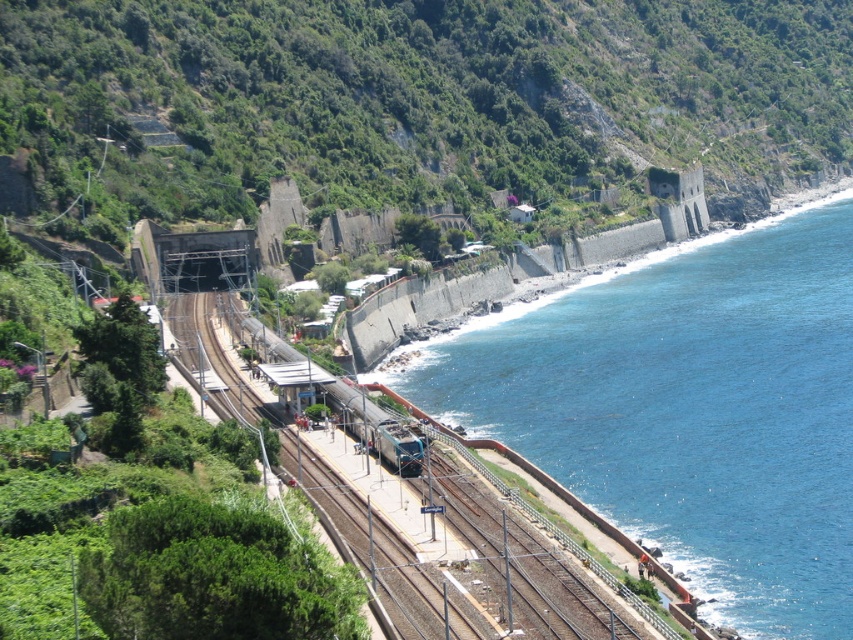
Which is more to the right, blue water at lower right or brown gravel track at center?

blue water at lower right is more to the right.

This screenshot has width=853, height=640. What do you see at coordinates (689, 410) in the screenshot?
I see `blue water at lower right` at bounding box center [689, 410].

The width and height of the screenshot is (853, 640). What do you see at coordinates (689, 410) in the screenshot? I see `blue water at lower right` at bounding box center [689, 410].

Where is `blue water at lower right`? blue water at lower right is located at coordinates (689, 410).

Describe the element at coordinates (689, 410) in the screenshot. This screenshot has height=640, width=853. I see `blue water at lower right` at that location.

Which is below, blue water at lower right or metallic blue train at center?

metallic blue train at center

Is point (517, 346) closer to camera compared to point (376, 433)?

No, it is not.

Where is `blue water at lower right`? This screenshot has width=853, height=640. blue water at lower right is located at coordinates (689, 410).

Consider the image. Can you confirm if brown gravel track at center is bigger than metallic blue train at center?

Correct, brown gravel track at center is larger in size than metallic blue train at center.

Is point (469, 566) farther from camera compared to point (360, 433)?

No, (469, 566) is closer to viewer.

Which is in front, point (190, 324) or point (404, 440)?

Point (404, 440) is in front.

Find the location of a particular element. This screenshot has height=640, width=853. brown gravel track at center is located at coordinates (415, 515).